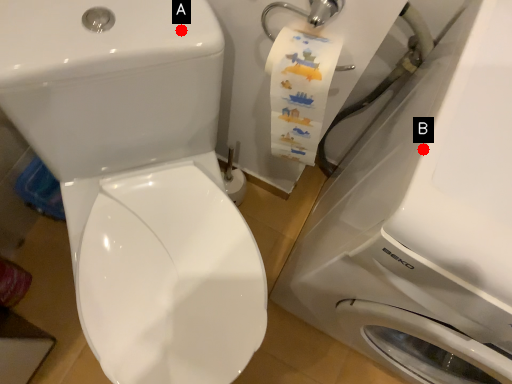
Question: Two points are circled on the image, labeled by A and B beside each circle. Which point appears closest to the camera in this image?

Choices:
 (A) A is closer
 (B) B is closer

Answer: (B)